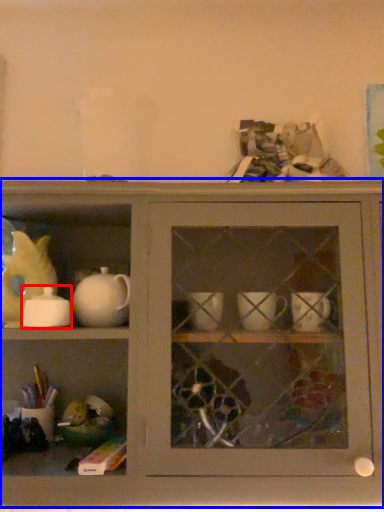
Question: Among these objects, which one is nearest to the camera, tableware (highlighted by a red box) or shelf (highlighted by a blue box)?

Choices:
 (A) tableware
 (B) shelf

Answer: (B)